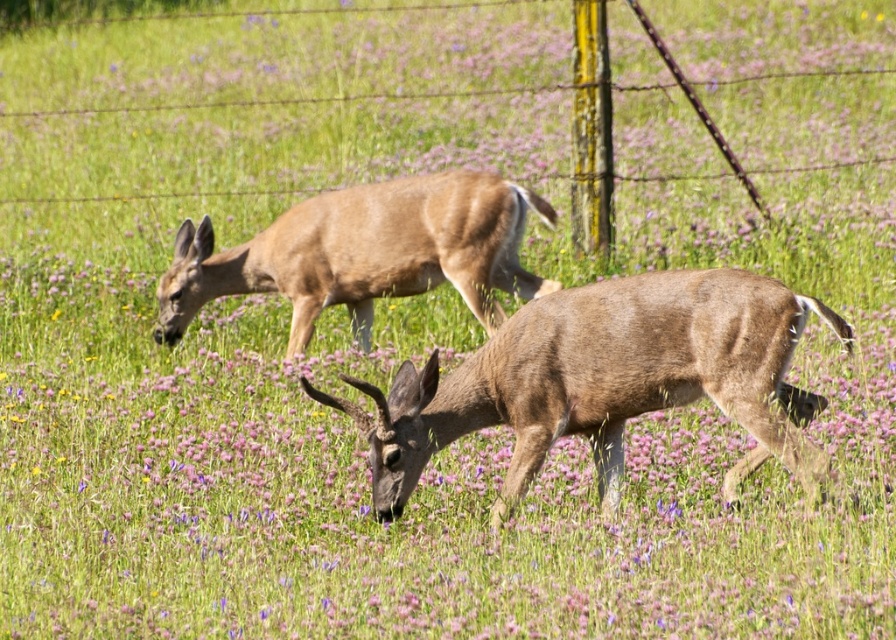
Can you confirm if brown matte/deer at center is bigger than brown matte deer at center?

Incorrect, brown matte/deer at center is not larger than brown matte deer at center.

Is brown matte/deer at center in front of brown matte deer at center?

That is True.

Who is more distant from viewer, (757, 388) or (248, 262)?

The point (248, 262) is more distant.

Find the location of a particular element. This screenshot has width=896, height=640. brown matte/deer at center is located at coordinates (605, 380).